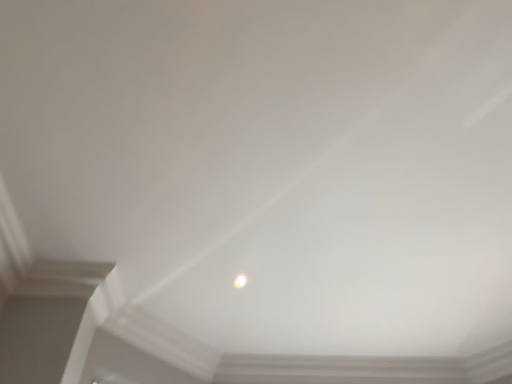
Identify the location of white matte light at center. The width and height of the screenshot is (512, 384). (240, 281).

What do you see at coordinates (240, 281) in the screenshot? I see `white matte light at center` at bounding box center [240, 281].

Identify the location of white matte light at center. The height and width of the screenshot is (384, 512). (240, 281).